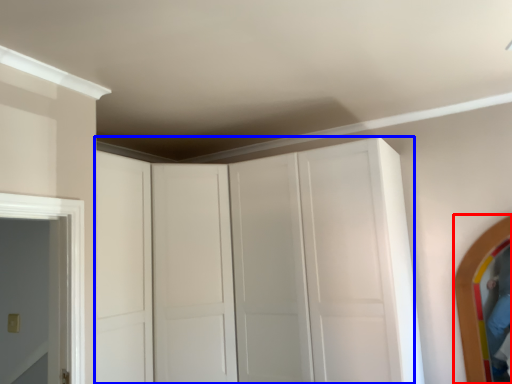
Question: Which object appears farthest to the camera in this image, mirror (highlighted by a red box) or dresser (highlighted by a blue box)?

Choices:
 (A) mirror
 (B) dresser

Answer: (A)